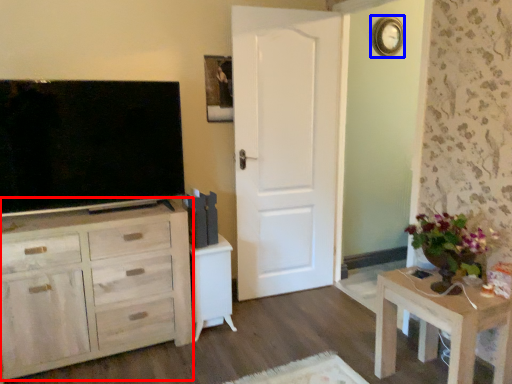
Question: Which object is closer to the camera taking this photo, cabinetry (highlighted by a red box) or clock (highlighted by a blue box)?

Choices:
 (A) cabinetry
 (B) clock

Answer: (A)